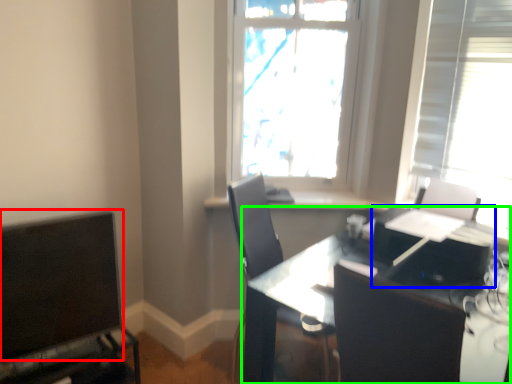
Question: Which object is positioned closest to computer monitor (highlighted by a red box)? Select from computer (highlighted by a blue box) and table (highlighted by a green box).

Choices:
 (A) computer
 (B) table

Answer: (B)